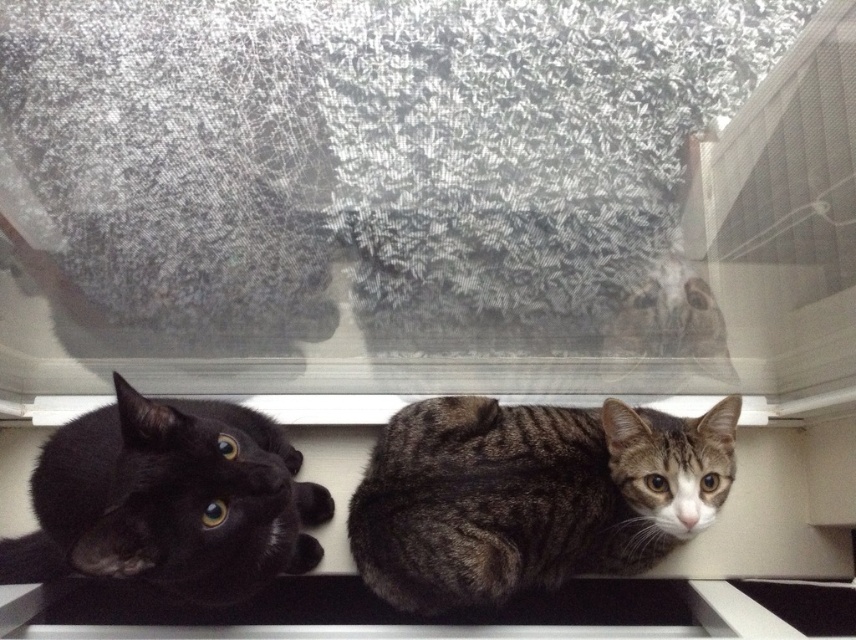
You are a cat owner who wants to ensure your cats have enough space to move around in their glass enclosure. Given that the tabby fur cat at lower right is positioned below the white plastic window sill at center, can you determine if there is enough vertical space between them for the cat to stand upright?

The tabby fur cat at lower right is below the white plastic window sill at center, but the exact vertical distance isn not specified. Without knowing the height of the cat or the clearance between them, it is impossible to determine if there is enough space for the cat to stand upright.

You are standing in front of a glass enclosure with two cats. There is a point at coordinates point (645, 516). Can you determine if this point is closer to you than the black cat on the left or the tabby cat on the right?

The point (645, 516) is 4.03 feet from the viewer, so it is closer to you than both the black cat on the left and the tabby cat on the right.